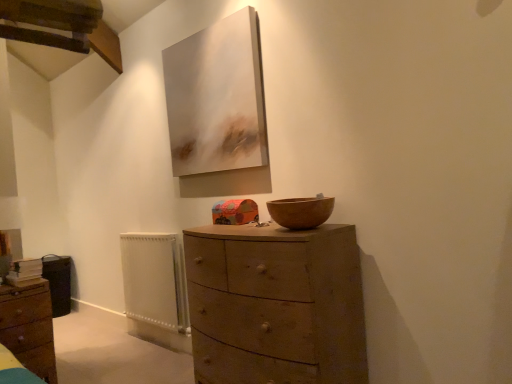
Where is `white painted metal radiator at lower left`? The width and height of the screenshot is (512, 384). white painted metal radiator at lower left is located at coordinates [154, 280].

What do you see at coordinates (29, 326) in the screenshot? The height and width of the screenshot is (384, 512). I see `matte brown chest of drawers at lower left, arranged as the first chest of drawers when viewed from the left` at bounding box center [29, 326].

The width and height of the screenshot is (512, 384). What do you see at coordinates (218, 109) in the screenshot?
I see `matte white canvas at upper center` at bounding box center [218, 109].

Describe the element at coordinates (301, 212) in the screenshot. I see `wooden bowl at center` at that location.

Find the location of `white painted metal radiator at lower left`. white painted metal radiator at lower left is located at coordinates (154, 280).

Would you say wooden chest of drawers at center, the first chest of drawers in the right-to-left sequence, is part of white painted metal radiator at lower left's contents?

No, wooden chest of drawers at center, the first chest of drawers in the right-to-left sequence, is not a part of white painted metal radiator at lower left.

Looking at this image, based on their positions, is white painted metal radiator at lower left located to the left or right of wooden chest of drawers at center, the first chest of drawers in the right-to-left sequence?

white painted metal radiator at lower left is to the left of wooden chest of drawers at center, the first chest of drawers in the right-to-left sequence.

Could you tell me if white painted metal radiator at lower left is facing wooden chest of drawers at center, the first chest of drawers in the right-to-left sequence?

No, white painted metal radiator at lower left does not turn towards wooden chest of drawers at center, the first chest of drawers in the right-to-left sequence.

The width and height of the screenshot is (512, 384). What are the coordinates of `the 1st chest of drawers in front of the white painted metal radiator at lower left` in the screenshot? It's located at (29, 326).

Can you tell me how much matte brown chest of drawers at lower left, which ranks as the 2th chest of drawers in right-to-left order, and white painted metal radiator at lower left differ in facing direction?

The angular difference between matte brown chest of drawers at lower left, which ranks as the 2th chest of drawers in right-to-left order, and white painted metal radiator at lower left is 86.5 degrees.

Is white painted metal radiator at lower left located within matte brown chest of drawers at lower left, which ranks as the 2th chest of drawers in right-to-left order?

That's incorrect, white painted metal radiator at lower left is not inside matte brown chest of drawers at lower left, which ranks as the 2th chest of drawers in right-to-left order.

Is wooden chest of drawers at center, the first chest of drawers in the right-to-left sequence, looking in the opposite direction of matte white canvas at upper center?

No.

Is wooden chest of drawers at center, the first chest of drawers in the right-to-left sequence, shorter than matte white canvas at upper center?

In fact, wooden chest of drawers at center, the first chest of drawers in the right-to-left sequence, may be taller than matte white canvas at upper center.

Image resolution: width=512 pixels, height=384 pixels. Find the location of `picture frame on the left of wooden chest of drawers at center, placed as the 2th chest of drawers when sorted from left to right`. picture frame on the left of wooden chest of drawers at center, placed as the 2th chest of drawers when sorted from left to right is located at coordinates (218, 109).

From a real-world perspective, who is located lower, wooden chest of drawers at center, the first chest of drawers in the right-to-left sequence, or matte white canvas at upper center?

wooden chest of drawers at center, the first chest of drawers in the right-to-left sequence.

From a real-world perspective, is wooden chest of drawers at center, placed as the 2th chest of drawers when sorted from left to right, located higher than wooden bowl at center?

No, from a real-world perspective, wooden chest of drawers at center, placed as the 2th chest of drawers when sorted from left to right, is not on top of wooden bowl at center.

This screenshot has height=384, width=512. In order to click on the 1st chest of drawers below the wooden bowl at center (from the image's perspective) in this screenshot , I will do `click(276, 305)`.

Is point (218, 360) less distant than point (316, 225)?

No, it is behind (316, 225).

How distant is wooden chest of drawers at center, placed as the 2th chest of drawers when sorted from left to right, from wooden bowl at center?

wooden chest of drawers at center, placed as the 2th chest of drawers when sorted from left to right, is 16.04 inches from wooden bowl at center.

Is wooden bowl at center smaller than matte white canvas at upper center?

Yes, wooden bowl at center is smaller than matte white canvas at upper center.

Is wooden bowl at center at the right side of matte white canvas at upper center?

Yes.

Which of these two, wooden bowl at center or matte white canvas at upper center, is wider?

wooden bowl at center.

Is the surface of wooden bowl at center in direct contact with matte white canvas at upper center?

No, wooden bowl at center is not in contact with matte white canvas at upper center.

Looking at the image, does matte white canvas at upper center seem bigger or smaller compared to wooden bowl at center?

Clearly, matte white canvas at upper center is larger in size than wooden bowl at center.

Is matte white canvas at upper center in front of or behind wooden bowl at center in the image?

matte white canvas at upper center is behind wooden bowl at center.

Is matte white canvas at upper center inside or outside of wooden bowl at center?

matte white canvas at upper center is not enclosed by wooden bowl at center.

Which point is more forward, (252, 56) or (305, 220)?

The point (305, 220) is more forward.

How far apart are white painted metal radiator at lower left and matte white canvas at upper center?

white painted metal radiator at lower left and matte white canvas at upper center are 36.64 inches apart from each other.

How different are the orientations of white painted metal radiator at lower left and matte white canvas at upper center in degrees?

The angle between the facing direction of white painted metal radiator at lower left and the facing direction of matte white canvas at upper center is 1.3 degrees.

This screenshot has width=512, height=384. I want to click on radiator below the matte white canvas at upper center (from a real-world perspective), so click(x=154, y=280).

Considering the relative positions of white painted metal radiator at lower left and matte white canvas at upper center in the image provided, is white painted metal radiator at lower left to the right of matte white canvas at upper center from the viewer's perspective?

No.

This screenshot has height=384, width=512. Identify the location of radiator located above the wooden chest of drawers at center, the first chest of drawers in the right-to-left sequence (from a real-world perspective). (154, 280).

Find the location of a particular element. The height and width of the screenshot is (384, 512). radiator lying on the right of matte brown chest of drawers at lower left, arranged as the first chest of drawers when viewed from the left is located at coordinates (154, 280).

Which object lies nearer to the anchor point matte white canvas at upper center, white painted metal radiator at lower left or matte brown chest of drawers at lower left, which ranks as the 2th chest of drawers in right-to-left order?

white painted metal radiator at lower left.

Looking at the image, which one is located further to matte brown chest of drawers at lower left, which ranks as the 2th chest of drawers in right-to-left order, wooden bowl at center or white painted metal radiator at lower left?

The object further to matte brown chest of drawers at lower left, which ranks as the 2th chest of drawers in right-to-left order, is wooden bowl at center.

Considering their positions, is wooden chest of drawers at center, the first chest of drawers in the right-to-left sequence, positioned further to white painted metal radiator at lower left than wooden bowl at center?

wooden bowl at center lies further to white painted metal radiator at lower left than the other object.

Estimate the real-world distances between objects in this image. Which object is closer to white painted metal radiator at lower left, wooden bowl at center or wooden chest of drawers at center, the first chest of drawers in the right-to-left sequence?

wooden chest of drawers at center, the first chest of drawers in the right-to-left sequence.

Estimate the real-world distances between objects in this image. Which object is closer to matte white canvas at upper center, matte brown chest of drawers at lower left, arranged as the first chest of drawers when viewed from the left, or white painted metal radiator at lower left?

Based on the image, white painted metal radiator at lower left appears to be nearer to matte white canvas at upper center.

From the image, which object appears to be nearer to matte brown chest of drawers at lower left, which ranks as the 2th chest of drawers in right-to-left order, wooden bowl at center or wooden chest of drawers at center, the first chest of drawers in the right-to-left sequence?

wooden chest of drawers at center, the first chest of drawers in the right-to-left sequence, is closer to matte brown chest of drawers at lower left, which ranks as the 2th chest of drawers in right-to-left order.

From the image, which object appears to be farther from matte white canvas at upper center, wooden bowl at center or matte brown chest of drawers at lower left, which ranks as the 2th chest of drawers in right-to-left order?

matte brown chest of drawers at lower left, which ranks as the 2th chest of drawers in right-to-left order.

From the image, which object appears to be farther from wooden chest of drawers at center, placed as the 2th chest of drawers when sorted from left to right, matte brown chest of drawers at lower left, arranged as the first chest of drawers when viewed from the left, or wooden bowl at center?

matte brown chest of drawers at lower left, arranged as the first chest of drawers when viewed from the left, is further to wooden chest of drawers at center, placed as the 2th chest of drawers when sorted from left to right.

Identify the location of picture frame between matte brown chest of drawers at lower left, which ranks as the 2th chest of drawers in right-to-left order, and wooden bowl at center from left to right. (218, 109).

What are the coordinates of `radiator between matte white canvas at upper center and matte brown chest of drawers at lower left, which ranks as the 2th chest of drawers in right-to-left order, vertically` in the screenshot? It's located at [x=154, y=280].

The width and height of the screenshot is (512, 384). Identify the location of bowl between matte white canvas at upper center and white painted metal radiator at lower left vertically. click(301, 212).

The width and height of the screenshot is (512, 384). Identify the location of bowl positioned between wooden chest of drawers at center, placed as the 2th chest of drawers when sorted from left to right, and white painted metal radiator at lower left from near to far. (301, 212).